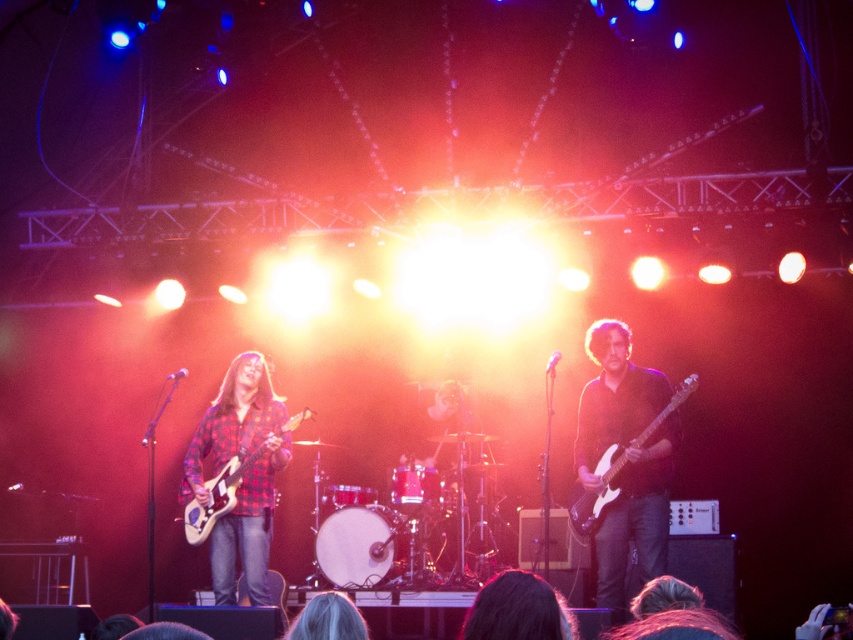
Between dark brown hair at lower center and plaid fabric guitar at left, which one has more height?

Standing taller between the two is plaid fabric guitar at left.

Which is in front, point (521, 616) or point (283, 428)?

Point (521, 616)

You are a GUI agent. You are given a task and a screenshot of the screen. Output one action in this format:
    pyautogui.click(x=<x>, y=<y>)
    Task: Click on the dark brown hair at lower center
    The height and width of the screenshot is (640, 853).
    Given the screenshot: What is the action you would take?
    pyautogui.click(x=518, y=609)

Does white glossy electric guitar at right have a greater height compared to plaid fabric guitar at left?

Yes.

Who is more distant from viewer, (585,497) or (193,540)?

Positioned behind is point (193,540).

Which is behind, point (671, 410) or point (213, 509)?

The point (213, 509) is more distant.

This screenshot has width=853, height=640. In order to click on white glossy electric guitar at right in this screenshot , I will do `click(598, 492)`.

Consider the image. Which of these two, white drumhead at center or gray hair at center, stands taller?

Standing taller between the two is white drumhead at center.

Consider the image. Which is below, white drumhead at center or gray hair at center?

Positioned lower is white drumhead at center.

Measure the distance between white drumhead at center and camera.

white drumhead at center is 24.27 feet away from camera.

Where is `white drumhead at center`? white drumhead at center is located at coordinates (357, 545).